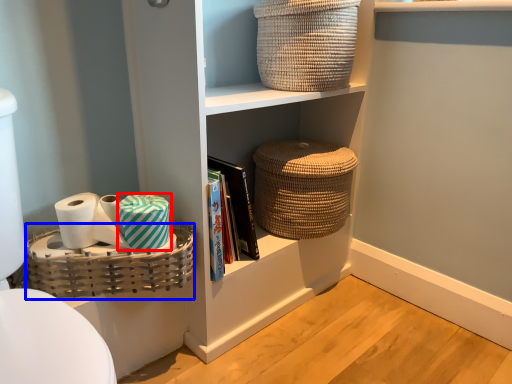
Question: Which point is further to the camera, material (highlighted by a red box) or basket (highlighted by a blue box)?

Choices:
 (A) material
 (B) basket

Answer: (A)